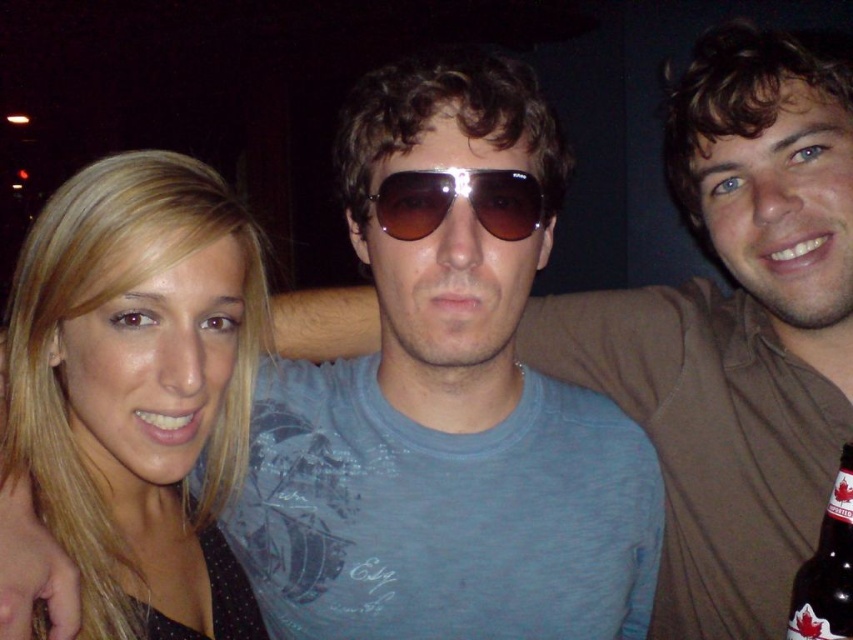
Question: Does matte blue t-shirt at center appear under brown glass bottle at lower right?

Choices:
 (A) yes
 (B) no

Answer: (B)

Question: Which object is the closest to the brown glass bottle at lower right?

Choices:
 (A) sunglasses at center
 (B) blonde hair at left
 (C) matte blue t-shirt at center

Answer: (C)

Question: Among these points, which one is nearest to the camera?

Choices:
 (A) (842, 497)
 (B) (426, 173)

Answer: (B)

Question: Can you confirm if blonde hair at left is wider than sunglasses at center?

Choices:
 (A) yes
 (B) no

Answer: (A)

Question: Does blonde hair at left appear under sunglasses at center?

Choices:
 (A) yes
 (B) no

Answer: (A)

Question: Which point is closer to the camera taking this photo?

Choices:
 (A) (845, 576)
 (B) (734, 401)
 (C) (393, 195)
 (D) (244, 264)

Answer: (C)